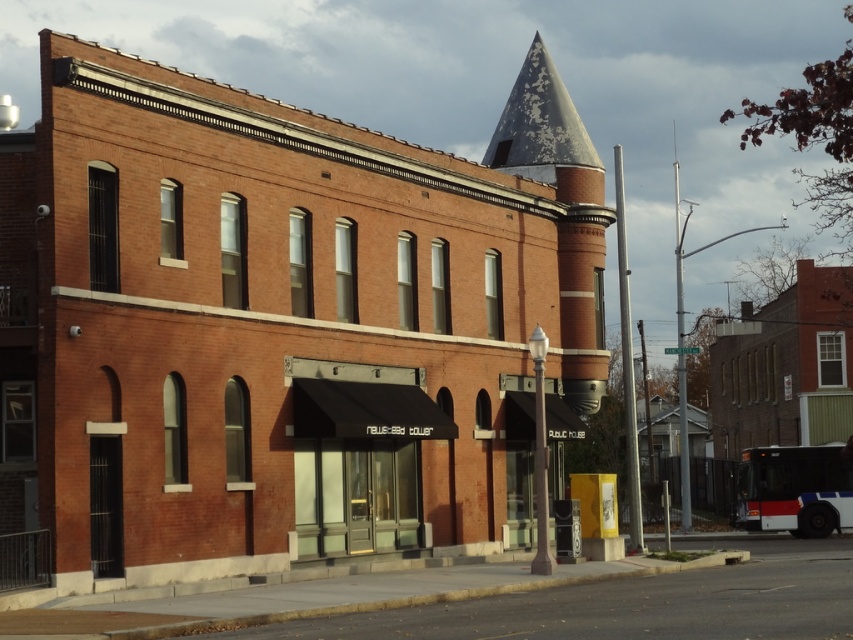
Who is more forward, (312, 474) or (572, 140)?

Point (312, 474)

Does point (421, 397) come farther from viewer compared to point (531, 141)?

No, (421, 397) is closer to viewer.

Locate an element on the screen. The height and width of the screenshot is (640, 853). black fabric awning at center is located at coordinates (360, 464).